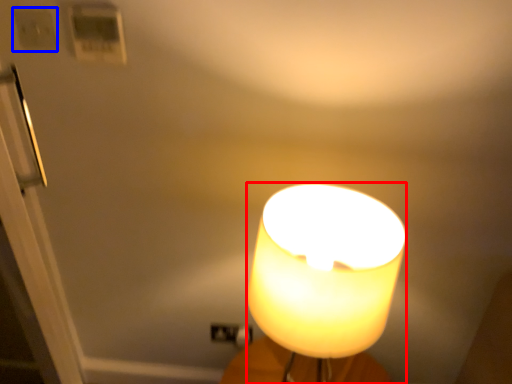
Question: Which point is closer to the camera, lamp (highlighted by a red box) or light switch (highlighted by a blue box)?

Choices:
 (A) lamp
 (B) light switch

Answer: (A)